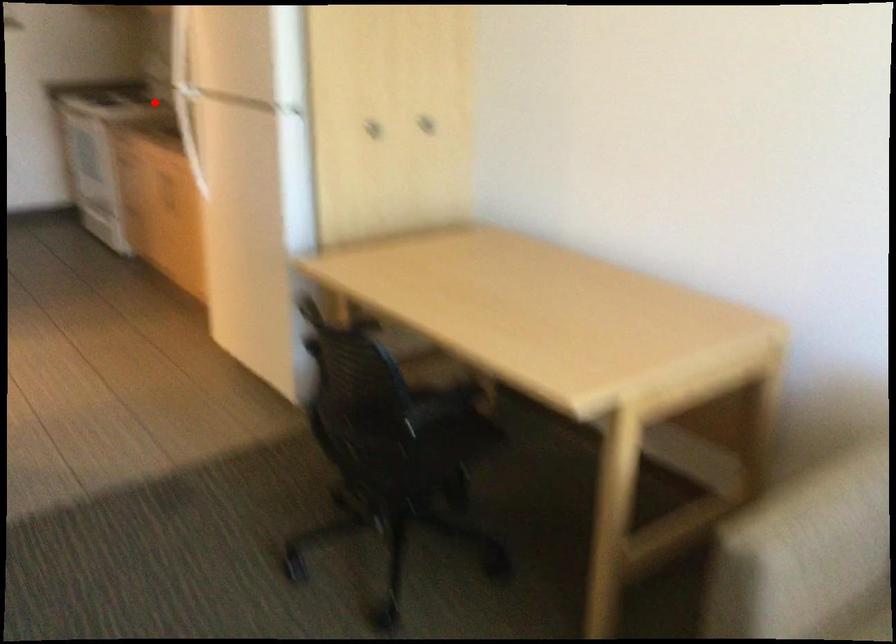
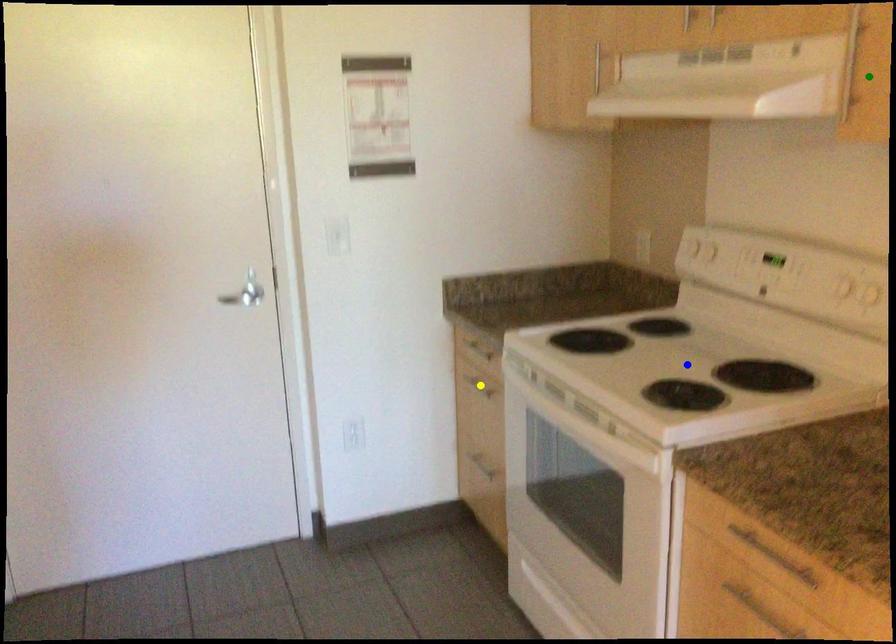
Question: I am providing you with two images of the same scene from different viewpoints. A red point is marked on the first image. You are given multiple points on the second image. Which point in image 2 is actually the same real-world point as the red point in image 1?

Choices:
 (A) green point
 (B) blue point
 (C) yellow point

Answer: (B)